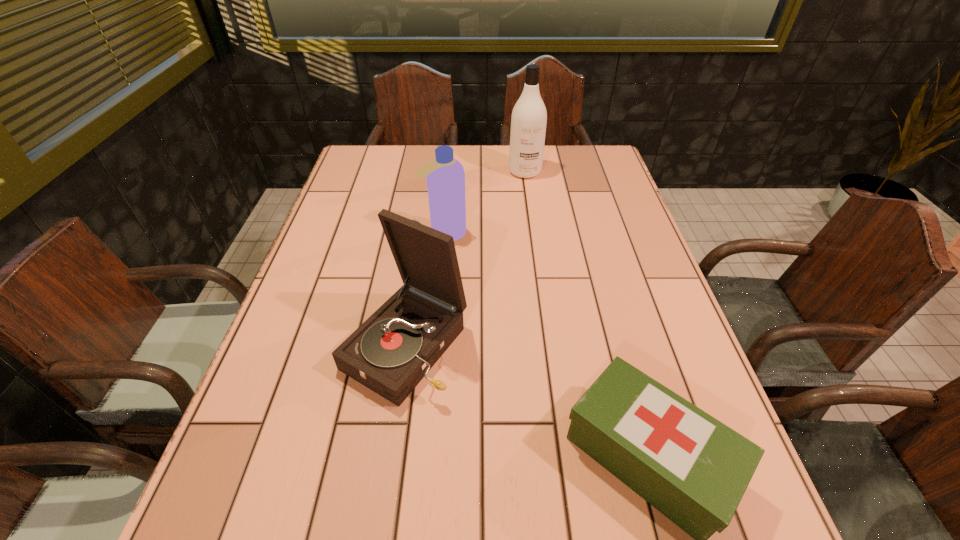
The image size is (960, 540). In the image, there is a desktop. What are the coordinates of `free region at the far edge` in the screenshot? It's located at (427, 151).

This screenshot has width=960, height=540. In order to click on vacant area at the left edge of the desktop in this screenshot , I will do `click(280, 486)`.

I want to click on free spot at the right edge of the desktop, so click(x=633, y=324).

Identify the location of vacant space at the far left corner. The width and height of the screenshot is (960, 540). (376, 154).

Find the location of a particular element. vacant area that lies between the nearer shampoo and the taller shampoo is located at coordinates (485, 202).

The height and width of the screenshot is (540, 960). What are the coordinates of `vacant area that lies between the right shampoo and the phonograph record` in the screenshot? It's located at (466, 259).

At what (x,y) coordinates should I click in order to perform the action: click on vacant area that lies between the right shampoo and the second farthest object. Please return your answer as a coordinate pair (x, y). Image resolution: width=960 pixels, height=540 pixels. Looking at the image, I should click on (485, 202).

This screenshot has height=540, width=960. I want to click on vacant area between the tallest object and the nearer shampoo, so click(485, 202).

Identify the location of the closest object to the second farthest object. [x=390, y=353].

Locate which object ranks in proximity to the phonograph record. Please provide its 2D coordinates. Your answer should be formatted as a tuple, i.e. [(x, y)], where the tuple contains the x and y coordinates of a point satisfying the conditions above.

[(692, 468)]